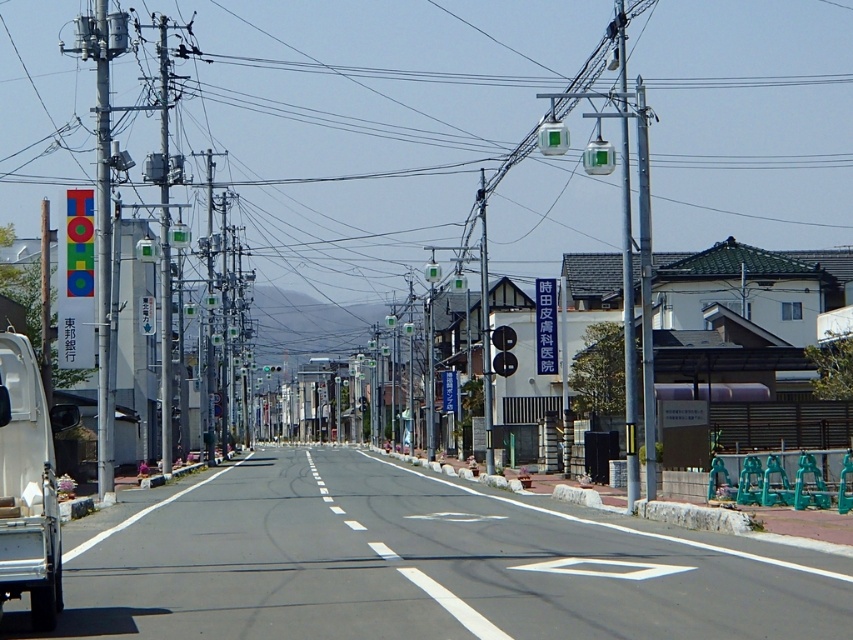
Question: Estimate the real-world distances between objects in this image. Which object is farther from the metallic signboard at left?

Choices:
 (A) metallic silver car at center
 (B) black plastic traffic light at center
 (C) metallic gray pole at center
 (D) metallic gray pole at center-right

Answer: (A)

Question: Among these points, which one is farthest from the camera?

Choices:
 (A) (627, 204)
 (B) (498, 339)

Answer: (B)

Question: From the image, what is the correct spatial relationship of white matte truck at left in relation to black plastic traffic light at center?

Choices:
 (A) below
 (B) above

Answer: (A)

Question: Which object is closer to the camera taking this photo?

Choices:
 (A) metallic signboard at left
 (B) metallic gray pole at left

Answer: (A)

Question: Does metallic gray pole at center appear over metallic gray pole at center-right?

Choices:
 (A) no
 (B) yes

Answer: (B)

Question: Does metallic signboard at left appear on the right side of metallic gray pole at left?

Choices:
 (A) yes
 (B) no

Answer: (A)